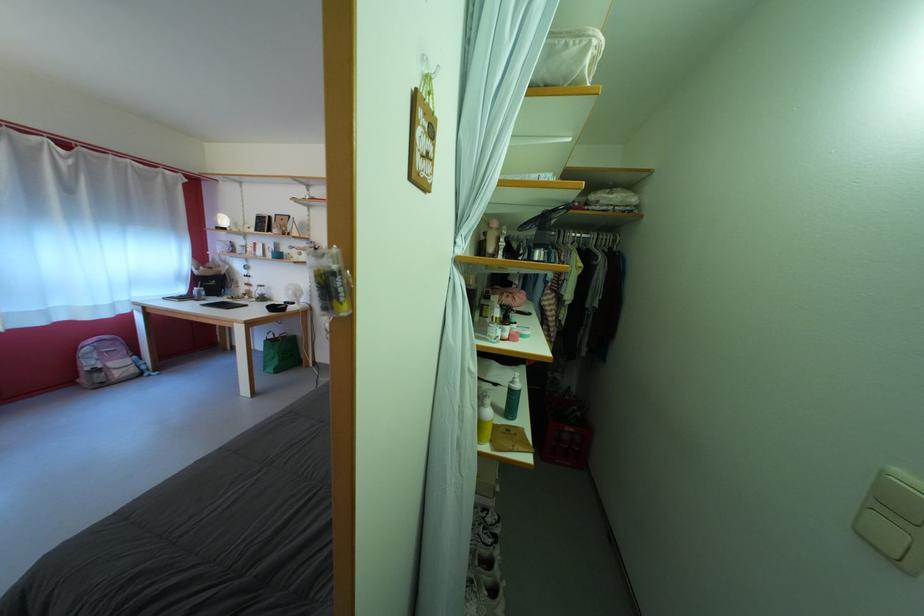
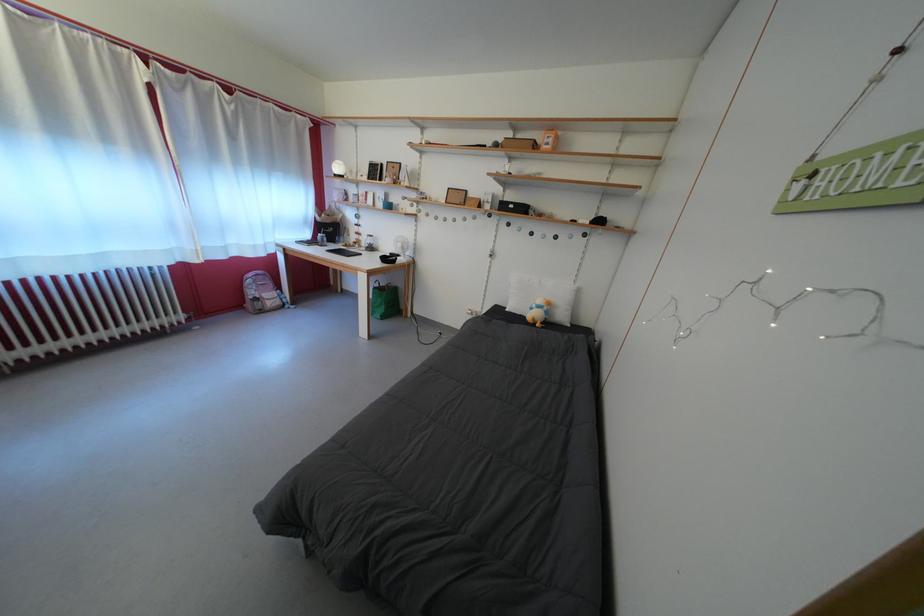
Where in the second image is the point corresponding to [299,299] from the first image?

(407, 251)